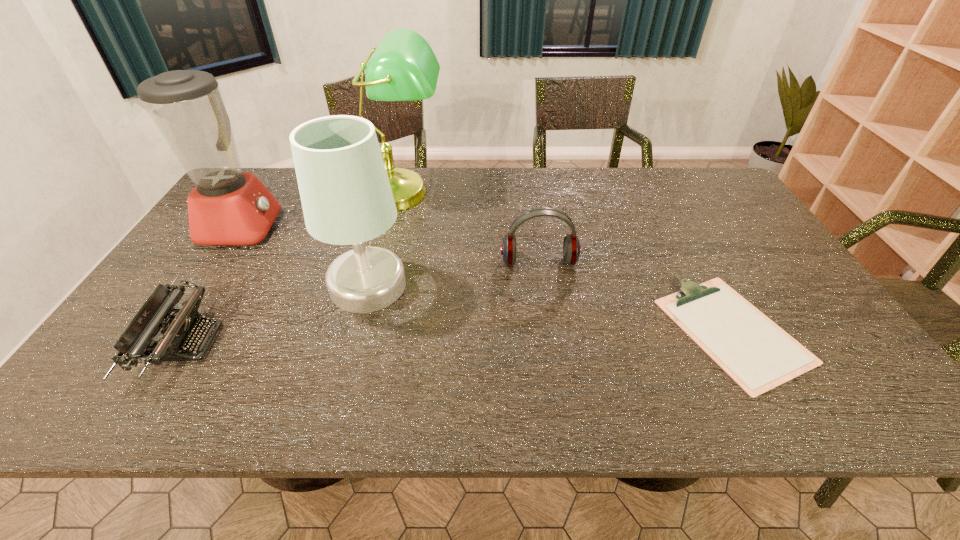
Where is `lamp`? lamp is located at coordinates (403, 67).

At what (x,y) coordinates should I click in order to perform the action: click on blender. Please return your answer as a coordinate pair (x, y). Looking at the image, I should click on (227, 207).

At what (x,y) coordinates should I click in order to perform the action: click on lampshade. Please return your answer as a coordinate pair (x, y). The height and width of the screenshot is (540, 960). Looking at the image, I should click on (346, 197).

Locate an element on the screen. This screenshot has height=540, width=960. earphone is located at coordinates (571, 246).

Identify the location of the third shortest object. click(571, 246).

Locate an element on the screen. The width and height of the screenshot is (960, 540). the second shortest object is located at coordinates (178, 332).

Where is `the shortest object`? The width and height of the screenshot is (960, 540). the shortest object is located at coordinates (756, 353).

Where is `clipboard`? The width and height of the screenshot is (960, 540). clipboard is located at coordinates (756, 353).

Image resolution: width=960 pixels, height=540 pixels. I want to click on vacant space positioned on the desk next to the lamp, so click(x=376, y=295).

Where is `vacant space located on the front of the blender near the controls`? vacant space located on the front of the blender near the controls is located at coordinates (406, 227).